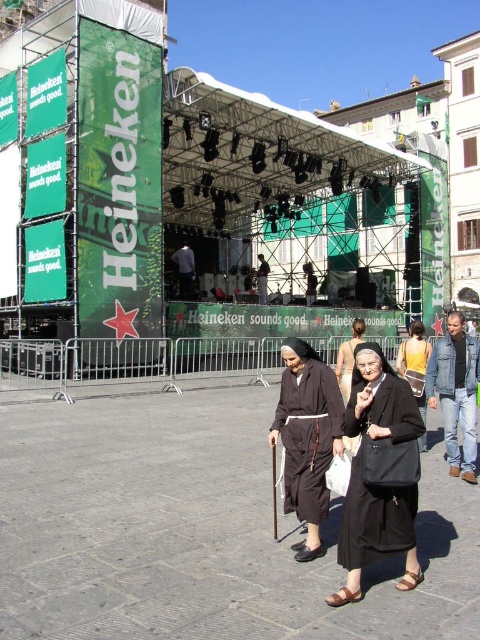
Between brown fabric nun at center and dark brown fabric robe at center, which one has less height?

With less height is brown fabric nun at center.

Find the location of a particular element. This screenshot has width=480, height=640. brown fabric nun at center is located at coordinates (307, 438).

This screenshot has width=480, height=640. Identify the location of brown fabric nun at center. (307, 438).

The image size is (480, 640). I want to click on brown fabric nun at center, so coord(307,438).

In the scene shown: Who is lower down, denim jacket at lower right or dark brown fabric robe at center?

denim jacket at lower right

What do you see at coordinates (456, 392) in the screenshot? The image size is (480, 640). I see `denim jacket at lower right` at bounding box center [456, 392].

Locate an element on the screen. This screenshot has height=640, width=480. denim jacket at lower right is located at coordinates (456, 392).

Is black fabric dress at center positioned at the back of black fabric nun at center?

That is False.

Is black fabric dress at center bigger than black fabric nun at center?

Yes, black fabric dress at center is bigger than black fabric nun at center.

Is point (409, 380) farther from viewer compared to point (360, 324)?

No, (409, 380) is in front of (360, 324).

Find the location of a particular element. black fabric dress at center is located at coordinates (415, 362).